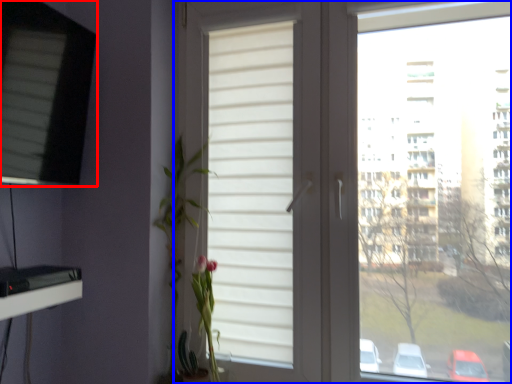
Question: Which object appears farthest to the camera in this image, window (highlighted by a red box) or window (highlighted by a blue box)?

Choices:
 (A) window
 (B) window

Answer: (A)